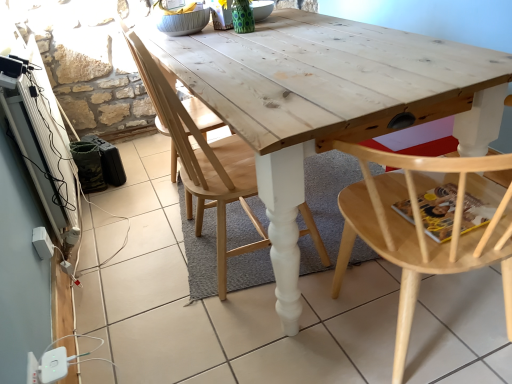
Identify the location of vacant space in front of natural wood chair at center, which appears as the 2th chair when viewed from the left. (239, 334).